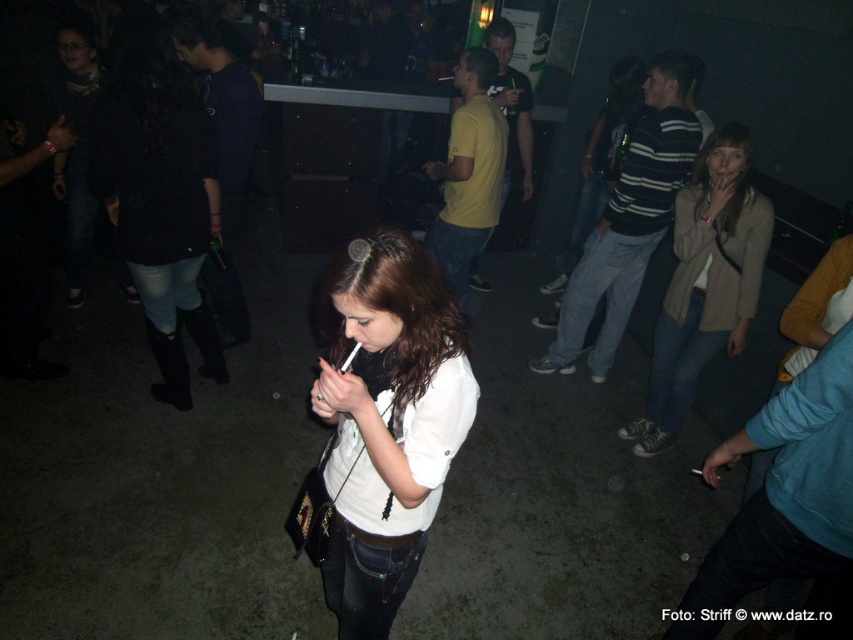
Question: Does white matte shirt at center appear on the left side of beige textured coat at right?

Choices:
 (A) no
 (B) yes

Answer: (B)

Question: Can you confirm if white matte shirt at center is positioned above beige textured coat at right?

Choices:
 (A) no
 (B) yes

Answer: (A)

Question: Which of the following is the farthest from the observer?

Choices:
 (A) (709, 230)
 (B) (335, 570)

Answer: (A)

Question: Is white matte shirt at center smaller than beige textured coat at right?

Choices:
 (A) yes
 (B) no

Answer: (A)

Question: Which object is closer to the camera taking this photo?

Choices:
 (A) white matte shirt at center
 (B) beige textured coat at right

Answer: (A)